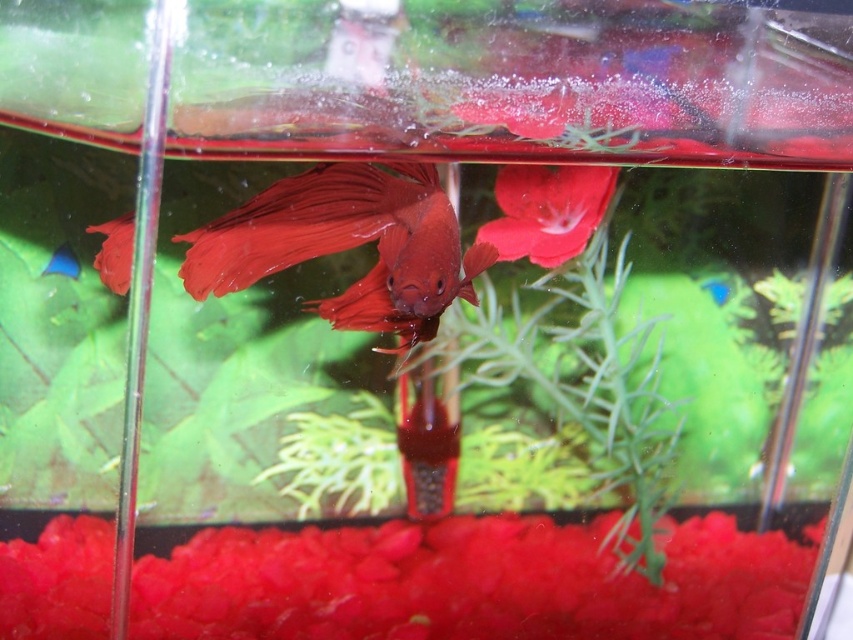
Between point (370, 208) and point (73, 268), which one is positioned behind?

Point (73, 268)

You are a GUI agent. You are given a task and a screenshot of the screen. Output one action in this format:
    pyautogui.click(x=<x>, y=<y>)
    Task: Click on the shiny red fish at center
    The height and width of the screenshot is (640, 853).
    Given the screenshot: What is the action you would take?
    pyautogui.click(x=347, y=244)